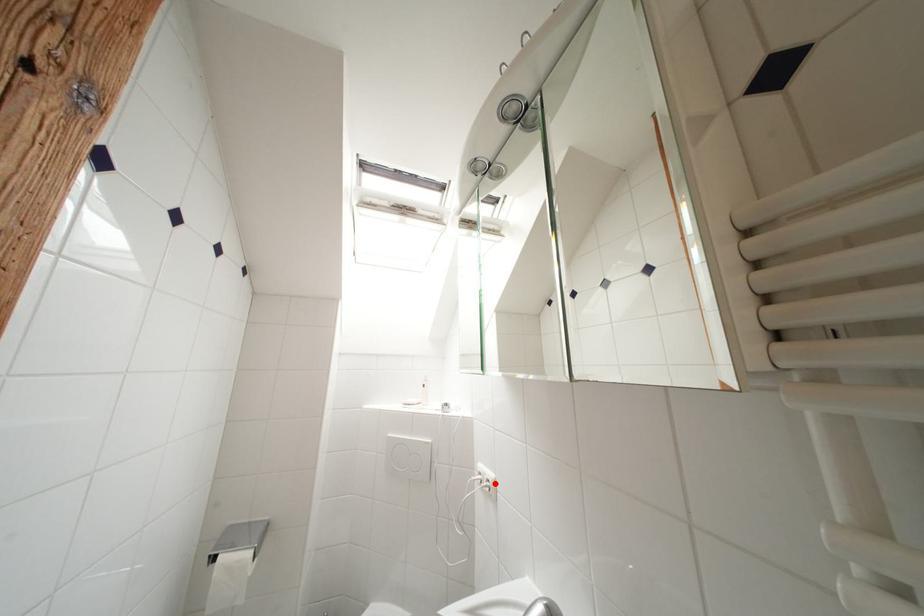
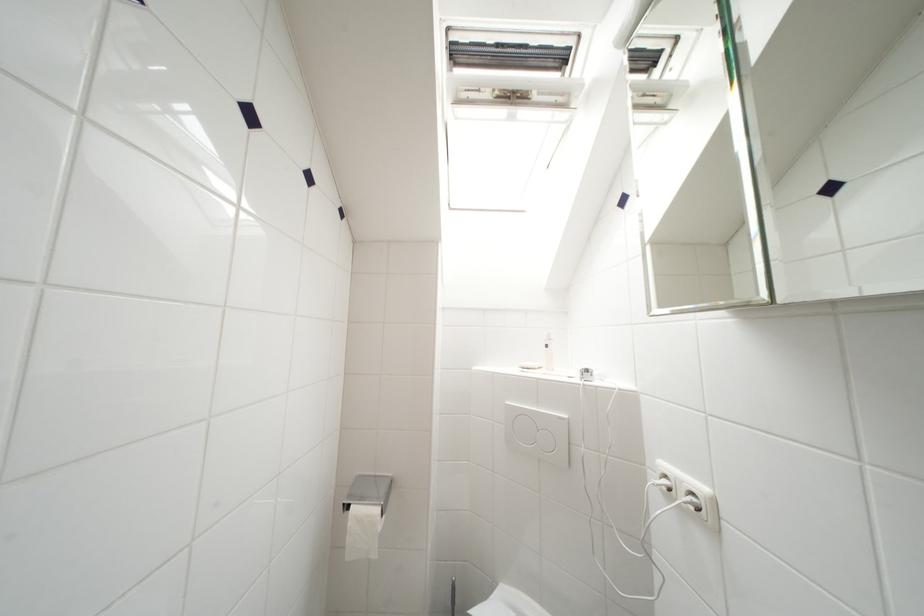
Find the pixel in the second image that matches the highlighted location in the first image.

(699, 498)